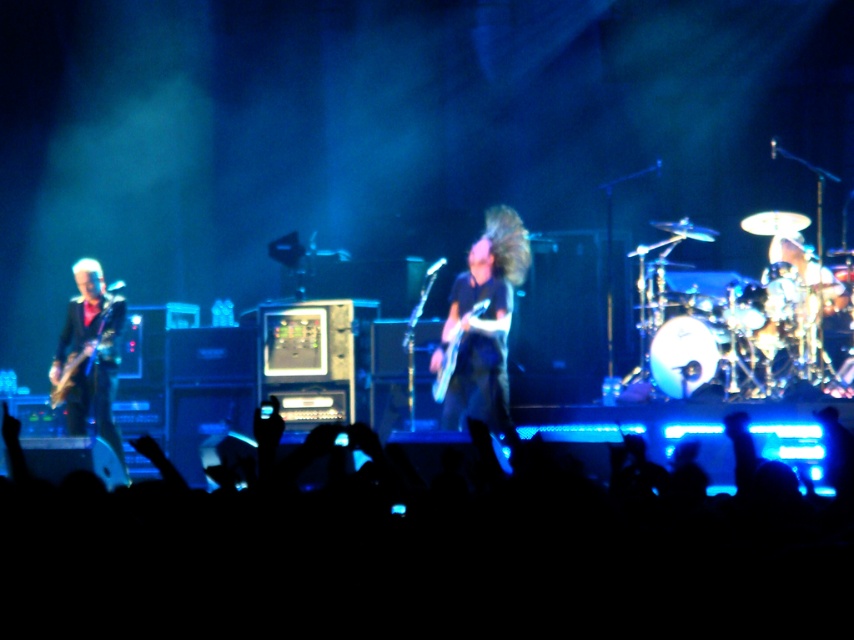
You are a photographer trying to capture the shiny black electric guitar at left and the black silhouettes at lower center in a single shot. Which object will appear larger in your photo?

The black silhouettes at lower center will appear larger in the photo because they are closer to the viewer than the shiny black electric guitar at left.

You are a photographer at the concert and want to capture a photo of the black silhouettes at lower center. The stage is divided into sections with coordinates. The point where you need to focus is at point (414,563). Can you confirm if the black silhouettes at lower center is located at that coordinate?

Yes, the black silhouettes at lower center is located at point (414,563), so you can focus there to capture the photo.